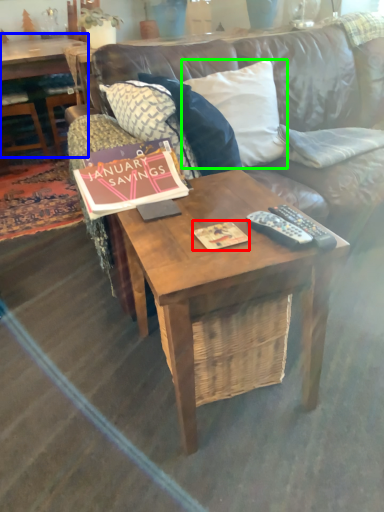
Question: Estimate the real-world distances between objects in this image. Which object is farther from magazine (highlighted by a red box), coffee table (highlighted by a blue box) or pillow (highlighted by a green box)?

Choices:
 (A) coffee table
 (B) pillow

Answer: (A)